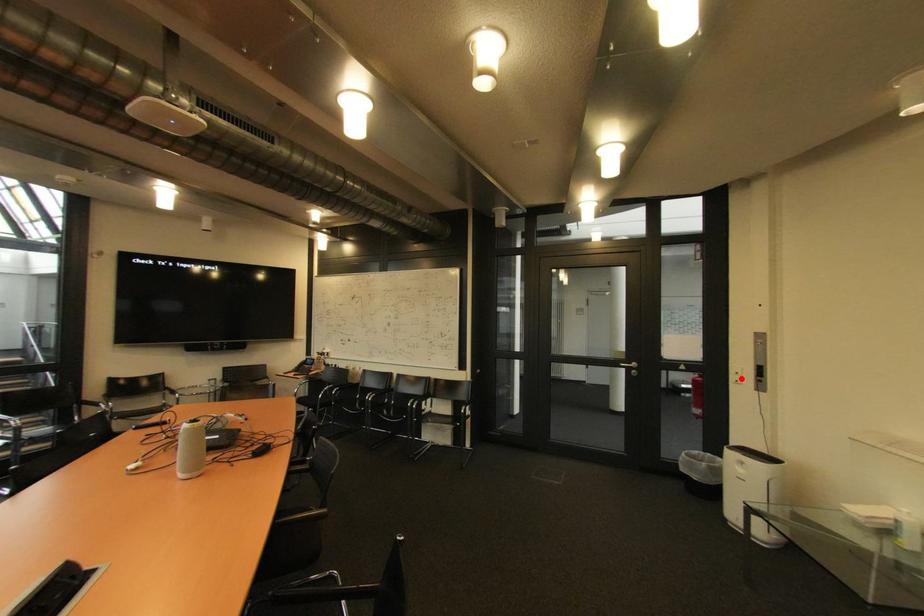
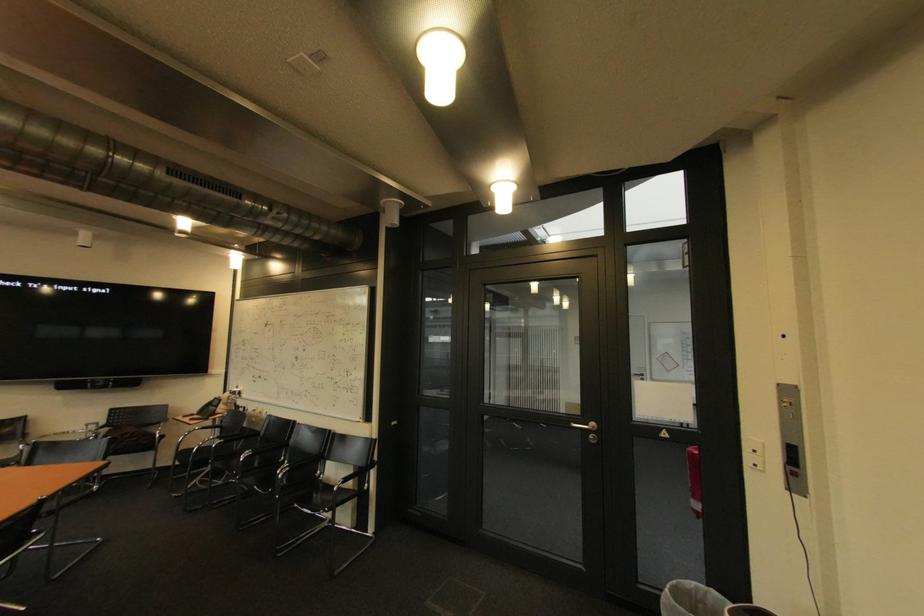
Locate, in the second image, the point that corresponds to the highlighted location in the first image.

(757, 459)